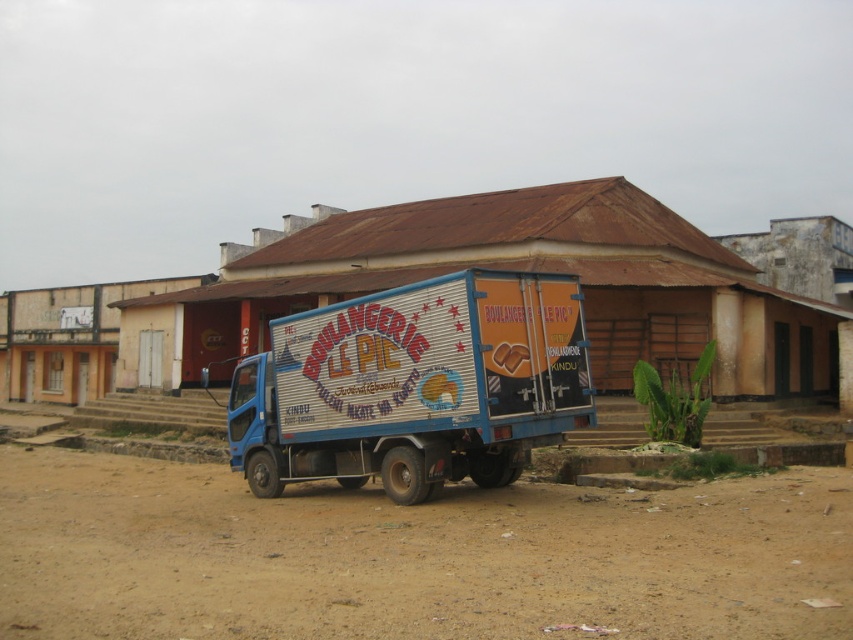
You are a delivery person trying to park your 2.5 meter wide van next to the blue metallic truck at center. There is brown sandy dirt at lower center where you want to park. Can you fit your van there without overlapping the truck?

The brown sandy dirt at lower center might be wider than blue metallic truck at center, so there is a possibility that the van could fit. However, since the exact width isn t confirmed, it s advisable to measure the space before parking.

You are standing at the point marked as point [413,556] in the image. What type of ground are you currently standing on?

The point [413,556] is on brown sandy dirt at lower center, so you are standing on brown sandy dirt.